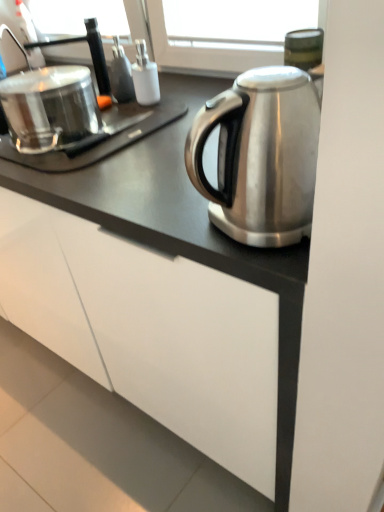
Question: Is brushed metal faucet at upper left inside or outside of shiny metallic pot at left?

Choices:
 (A) inside
 (B) outside

Answer: (B)

Question: Considering the positions of brushed metal faucet at upper left and shiny metallic pot at left in the image, is brushed metal faucet at upper left taller or shorter than shiny metallic pot at left?

Choices:
 (A) short
 (B) tall

Answer: (A)

Question: Estimate the real-world distances between objects in this image. Which object is farther from the brushed metal faucet at upper left?

Choices:
 (A) shiny metallic pot at left
 (B) white matte cabinet at lower center

Answer: (B)

Question: Estimate the real-world distances between objects in this image. Which object is farther from the white matte cabinet at lower center?

Choices:
 (A) brushed metal faucet at upper left
 (B) shiny metallic pot at left

Answer: (A)